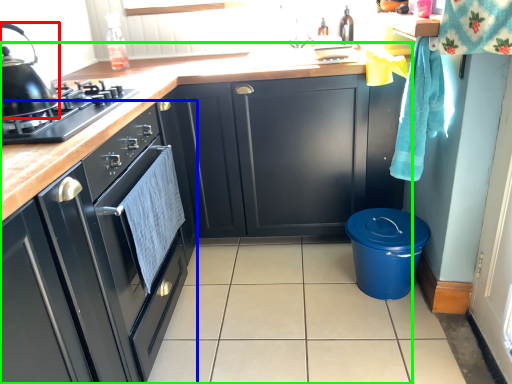
Question: Considering the real-world distances, which object is farthest from kitchen appliance (highlighted by a red box)? cabinetry (highlighted by a blue box) or cabinetry (highlighted by a green box)?

Choices:
 (A) cabinetry
 (B) cabinetry

Answer: (B)